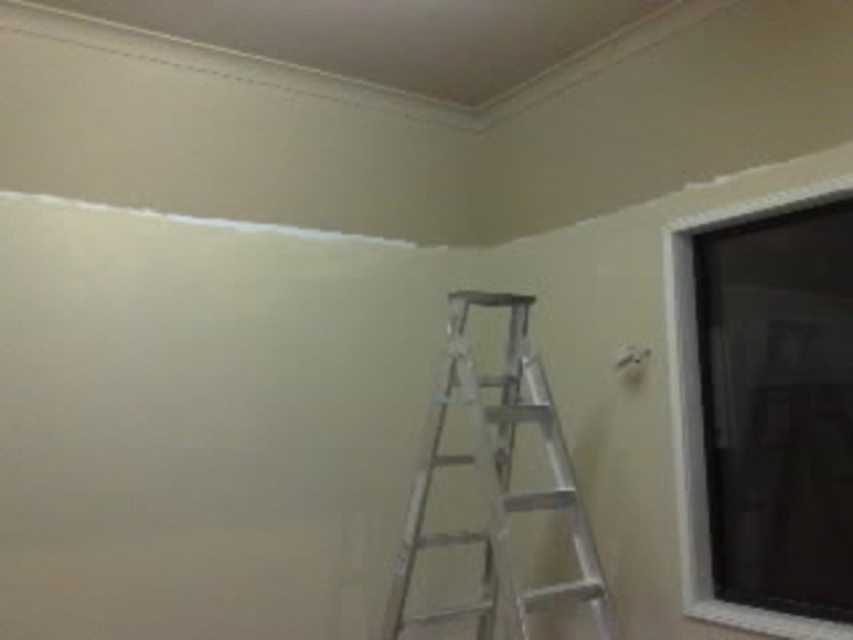
Question: Can you confirm if silver metallic ladder at center is positioned above clear glass window at upper right?

Choices:
 (A) yes
 (B) no

Answer: (B)

Question: Does silver metallic ladder at center have a lesser width compared to clear glass window at upper right?

Choices:
 (A) yes
 (B) no

Answer: (B)

Question: Does silver metallic ladder at center have a larger size compared to clear glass window at upper right?

Choices:
 (A) no
 (B) yes

Answer: (B)

Question: Which of the following is the farthest from the observer?

Choices:
 (A) clear glass window at upper right
 (B) silver metallic ladder at center

Answer: (B)